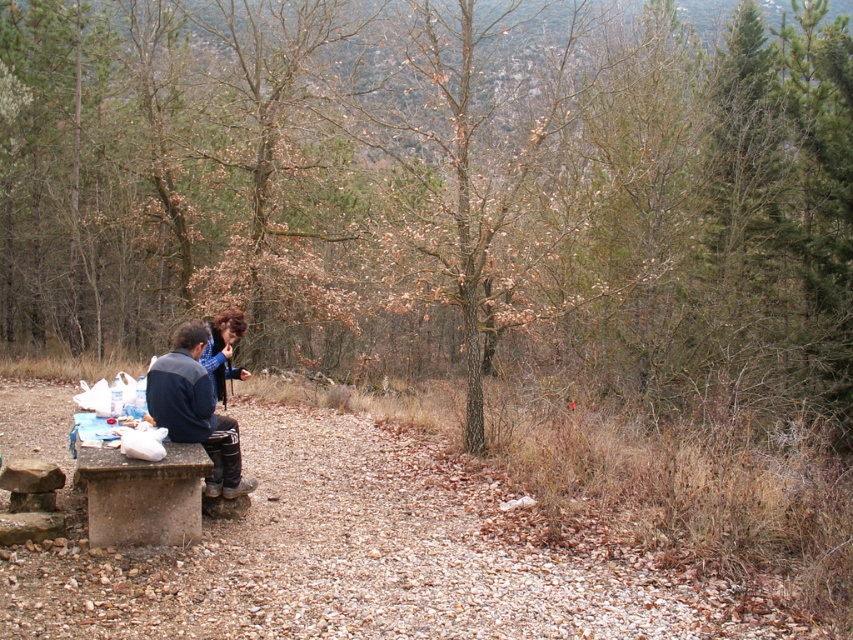
Question: Can you confirm if brown bark tree at center is positioned to the left of concrete bench at lower left?

Choices:
 (A) no
 (B) yes

Answer: (A)

Question: Does brown bark tree at center appear on the left side of dark blue jacket at left?

Choices:
 (A) yes
 (B) no

Answer: (B)

Question: Which point is farther from the camera taking this photo?

Choices:
 (A) (155, 362)
 (B) (268, 26)

Answer: (B)

Question: Which is farther from the brown bark tree at center?

Choices:
 (A) dark blue jacket at left
 (B) smooth concrete bench at lower left

Answer: (A)

Question: Considering the relative positions of dark blue jacket at left and matte blue shirt at center in the image provided, where is dark blue jacket at left located with respect to matte blue shirt at center?

Choices:
 (A) left
 (B) right

Answer: (B)

Question: Estimate the real-world distances between objects in this image. Which object is closer to the dark blue jacket at left?

Choices:
 (A) brown bark tree at center
 (B) concrete bench at lower left
 (C) smooth concrete bench at lower left
 (D) matte blue shirt at center

Answer: (D)